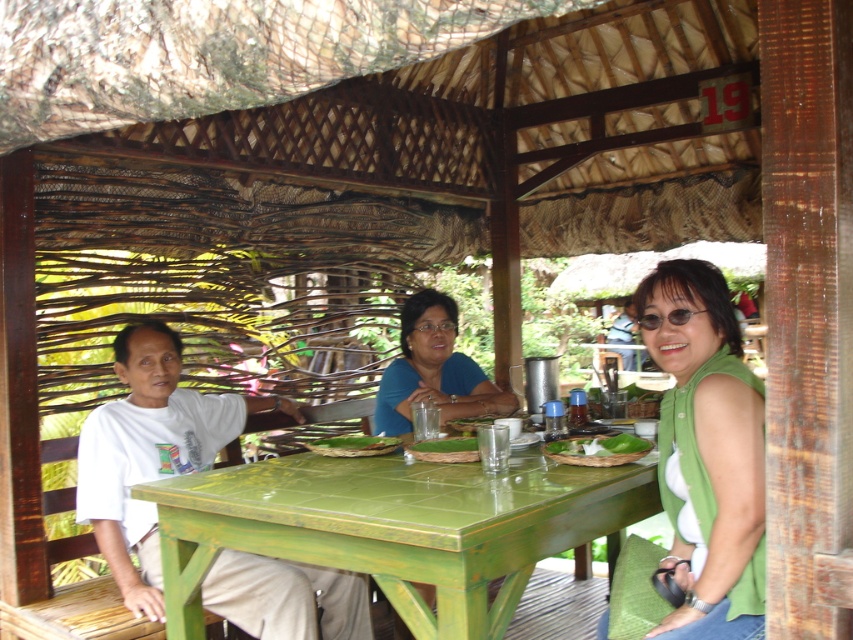
Question: Can you confirm if green sleeveless shirt at center is wider than white matte shirt at left?

Choices:
 (A) no
 (B) yes

Answer: (A)

Question: Is blue matte shirt at center closer to camera compared to green woven mat at table?

Choices:
 (A) no
 (B) yes

Answer: (A)

Question: Which of the following is the closest to the observer?

Choices:
 (A) (485, 584)
 (B) (555, 442)

Answer: (A)

Question: Is white matte shirt at left smaller than green woven mat at table?

Choices:
 (A) yes
 (B) no

Answer: (B)

Question: Which object is closer to the camera taking this photo?

Choices:
 (A) white matte shirt at left
 (B) green leafy vegetable at table center
 (C) green leafy vegetable at table
 (D) green woven mat at table

Answer: (A)

Question: Which point is farther to the camera?

Choices:
 (A) (444, 445)
 (B) (204, 557)
 (C) (746, 504)

Answer: (A)